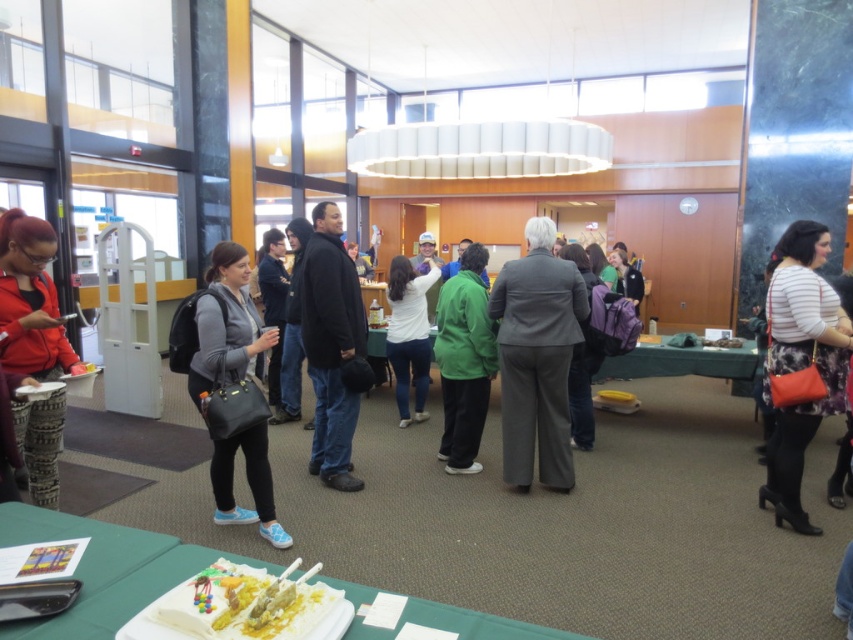
Question: Does white paper plate at lower center have a greater width compared to striped fabric dress at center?

Choices:
 (A) yes
 (B) no

Answer: (A)

Question: Considering the relative positions of matte black bag at center and black matte jacket at center in the image provided, where is matte black bag at center located with respect to black matte jacket at center?

Choices:
 (A) above
 (B) below

Answer: (B)

Question: Which point appears closest to the camera in this image?

Choices:
 (A) (473, 636)
 (B) (405, 330)
 (C) (204, 362)

Answer: (A)

Question: Which object is closer to the camera taking this photo?

Choices:
 (A) white matte shirt at center
 (B) striped fabric dress at center
 (C) matte red jacket at left
 (D) black matte jacket at center

Answer: (C)

Question: Which is farther from the striped fabric dress at center?

Choices:
 (A) black matte jacket at center
 (B) white matte shirt at center

Answer: (B)

Question: Can you confirm if yellow frosted cake at lower center is positioned to the left of matte black jacket at center?

Choices:
 (A) yes
 (B) no

Answer: (B)